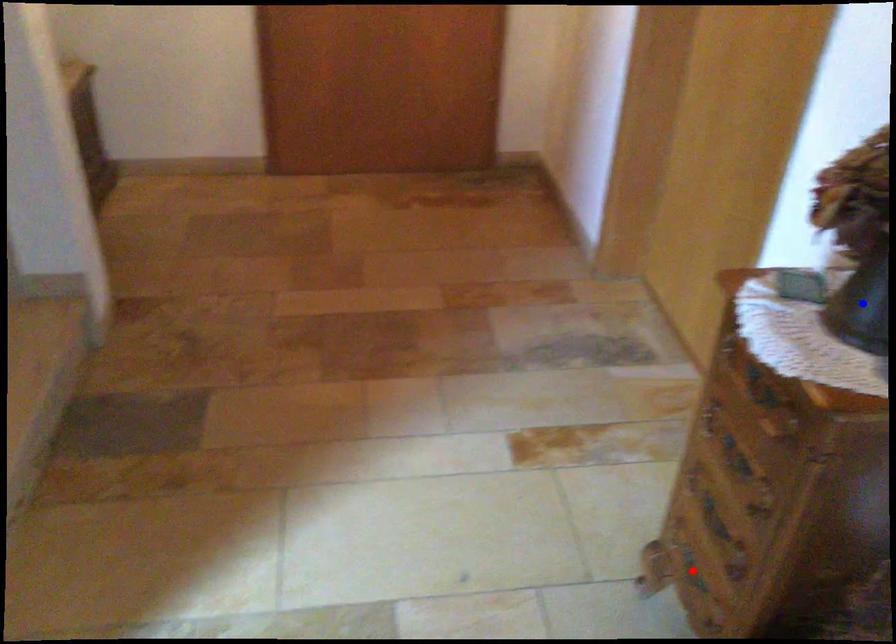
Question: Which of the two points in the image is closer to the camera?

Choices:
 (A) Blue point is closer.
 (B) Red point is closer.

Answer: (A)